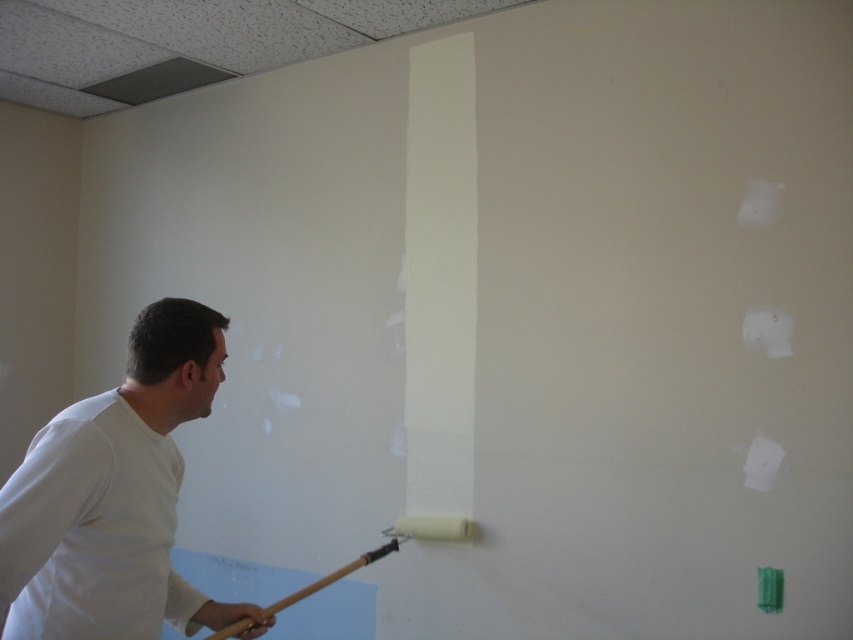
Question: Is white matte shirt at left bigger than wooden paintbrush at lower left?

Choices:
 (A) no
 (B) yes

Answer: (B)

Question: Does white matte shirt at left lie behind wooden paintbrush at lower left?

Choices:
 (A) no
 (B) yes

Answer: (A)

Question: Where is white matte shirt at left located in relation to wooden paintbrush at lower left in the image?

Choices:
 (A) above
 (B) below

Answer: (A)

Question: Which of the following is the closest to the observer?

Choices:
 (A) (199, 372)
 (B) (212, 636)

Answer: (A)

Question: Which point appears closest to the camera in this image?

Choices:
 (A) (138, 604)
 (B) (328, 576)

Answer: (A)